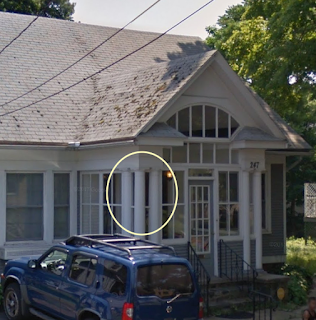
Locate an element on the screen. This screenshot has height=320, width=316. front door is located at coordinates (209, 260).